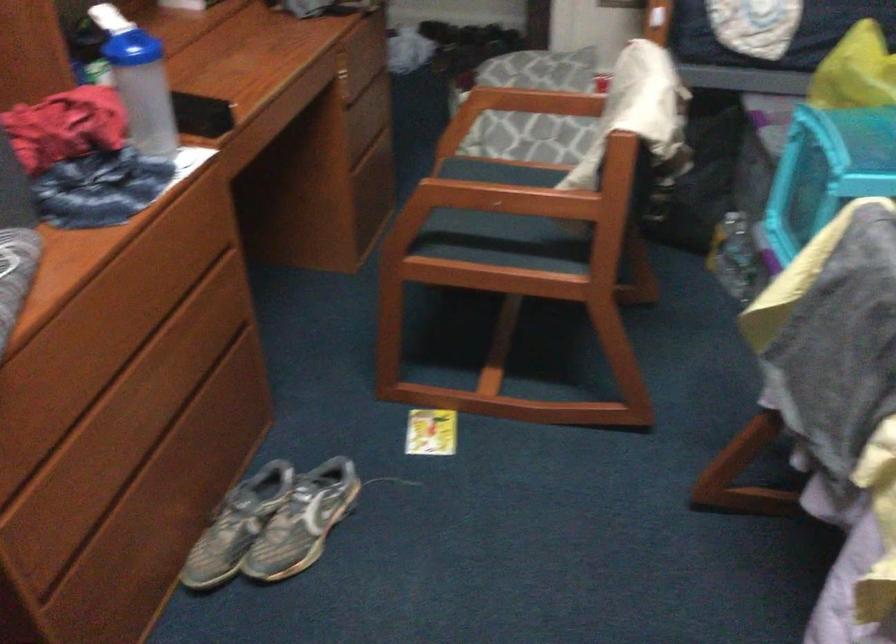
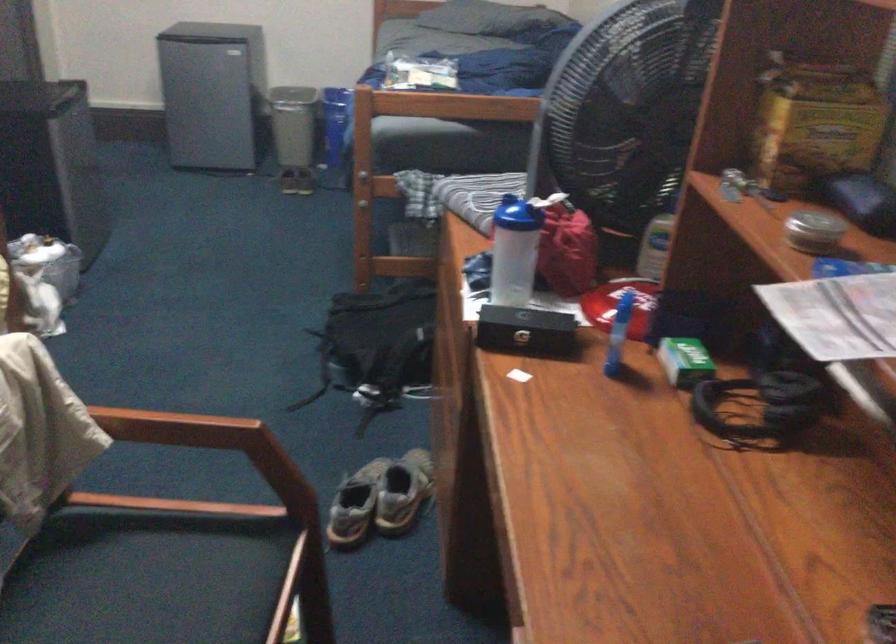
Where in the second image is the point corresponding to (x=145, y=82) from the first image?

(513, 251)